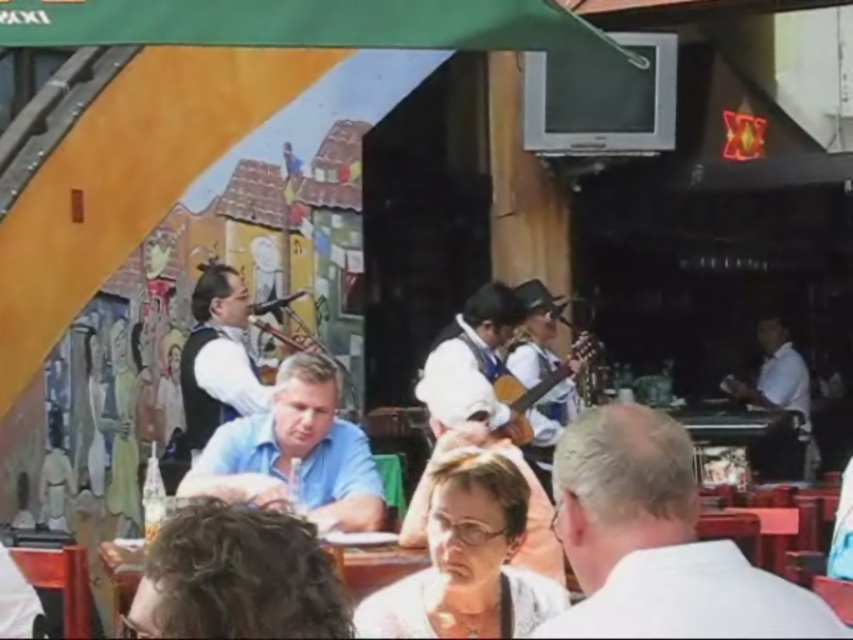
Consider the image. You are a photographer at the outdoor cafe and want to capture both the white fabric shirt at center and the white smooth shirt at right in a single photo. Which shirt should you focus on first to ensure both are in frame?

The white fabric shirt at center is located above the white smooth shirt at right, so focusing on the white fabric shirt at center first will help ensure both are in frame.

You are standing at the point labeled point (520, 406) and want to walk towards the point labeled point (805, 385). Which direction should you move to get closer to your destination?

To move towards point (805, 385) from point (520, 406), you should move forward since point (805, 385) is closer to the camera and thus in front of point (520, 406).